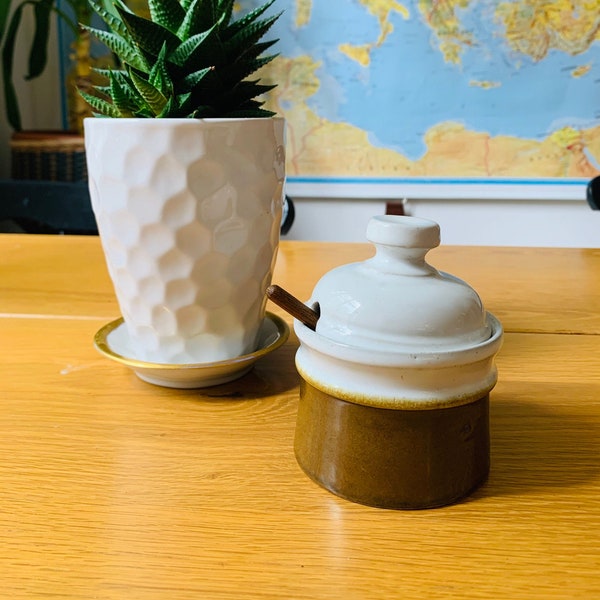
Where is `table top`? The image size is (600, 600). table top is located at coordinates (245, 543).